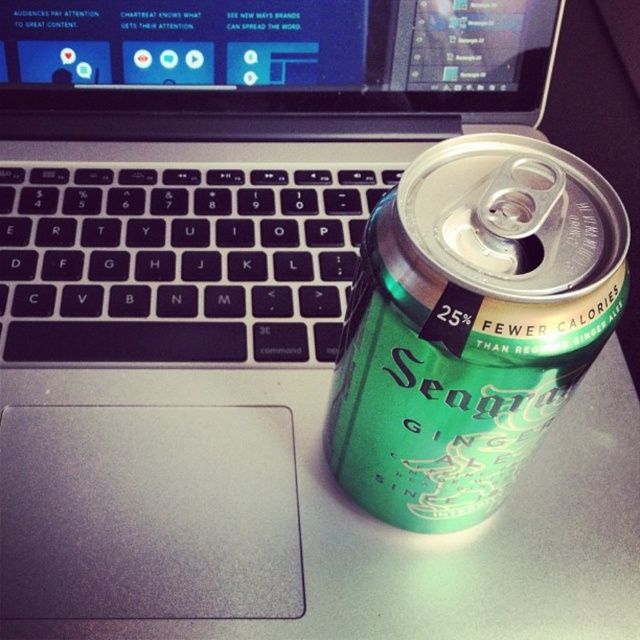
Question: Among these points, which one is farthest from the camera?

Choices:
 (A) (289, 324)
 (B) (556, 330)

Answer: (A)

Question: Does green metallic can at right appear over black matte keyboard at left?

Choices:
 (A) no
 (B) yes

Answer: (A)

Question: Which object appears farthest from the camera in this image?

Choices:
 (A) green metallic can at right
 (B) black matte keyboard at left

Answer: (B)

Question: Is green metallic can at right positioned at the back of black matte keyboard at left?

Choices:
 (A) yes
 (B) no

Answer: (B)

Question: Is the position of green metallic can at right less distant than that of black matte keyboard at left?

Choices:
 (A) yes
 (B) no

Answer: (A)